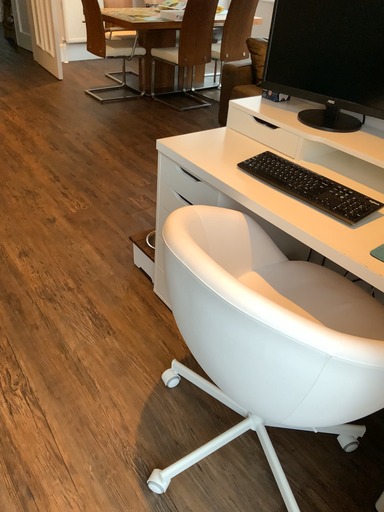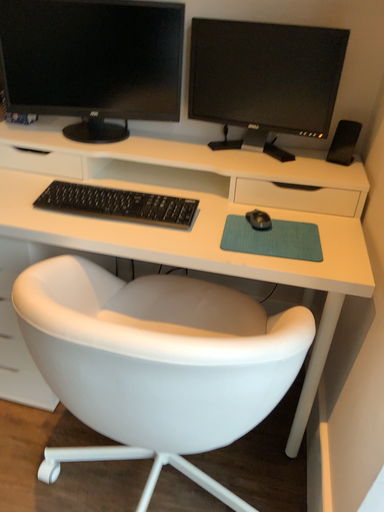
Question: Which way did the camera rotate in the video?

Choices:
 (A) rotated right
 (B) rotated left

Answer: (A)